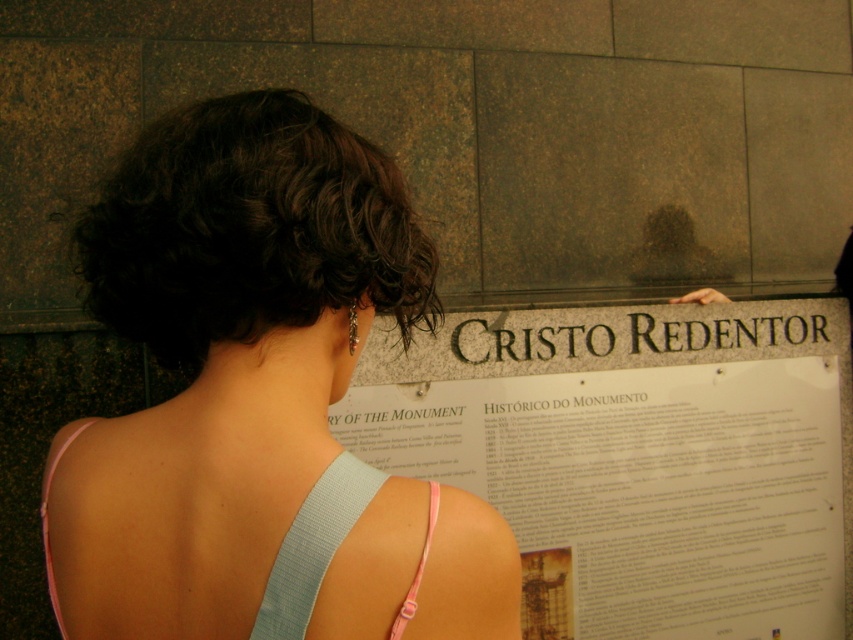
Question: Can you confirm if white paper sign at center is positioned below light blue fabric strap at upper center?

Choices:
 (A) no
 (B) yes

Answer: (B)

Question: Which of the following is the farthest from the observer?

Choices:
 (A) white paper sign at center
 (B) dark brown curly hair at upper left

Answer: (A)

Question: Can you confirm if dark brown curly hair at upper left is thinner than light blue fabric strap at upper center?

Choices:
 (A) no
 (B) yes

Answer: (A)

Question: Which object is closer to the camera taking this photo?

Choices:
 (A) light blue fabric strap at upper center
 (B) light blue fabric tank top at center
 (C) white paper sign at center
 (D) dark brown curly hair at upper left

Answer: (A)

Question: Which of the following is the closest to the observer?

Choices:
 (A) white paper sign at center
 (B) dark brown curly hair at upper left
 (C) light blue fabric dress at center

Answer: (C)

Question: Observing the image, what is the correct spatial positioning of light blue fabric tank top at center in reference to light blue fabric dress at center?

Choices:
 (A) above
 (B) below

Answer: (A)